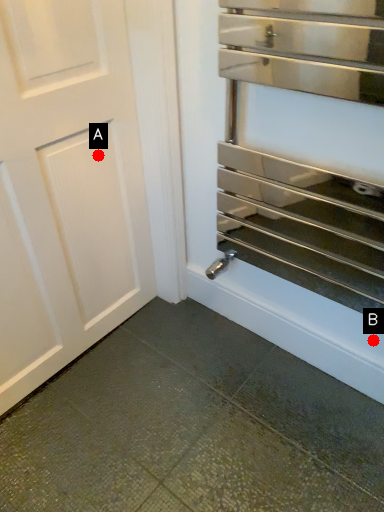
Question: Two points are circled on the image, labeled by A and B beside each circle. Which point is farther to the camera?

Choices:
 (A) A is further
 (B) B is further

Answer: (A)